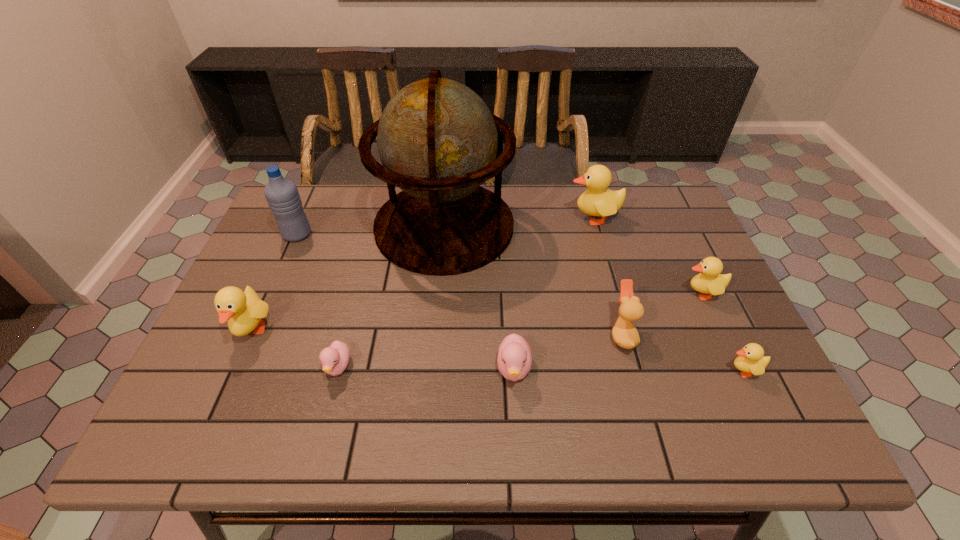
In order to click on globe in this screenshot , I will do `click(437, 140)`.

Find the location of a particular element. the eighth shortest object is located at coordinates (282, 195).

Locate an element on the screen. The image size is (960, 540). water bottle is located at coordinates (282, 195).

Image resolution: width=960 pixels, height=540 pixels. Find the location of `the biggest yellow duckling`. the biggest yellow duckling is located at coordinates (597, 200).

I want to click on the second yellow duckling from left to right, so click(x=597, y=200).

At what (x,y) coordinates should I click in order to perform the action: click on the leftmost duckling. Please return your answer as a coordinate pair (x, y). Image resolution: width=960 pixels, height=540 pixels. Looking at the image, I should click on (244, 310).

You are a GUI agent. You are given a task and a screenshot of the screen. Output one action in this format:
    pyautogui.click(x=<x>, y=<y>)
    Task: Click on the second tallest duckling
    This screenshot has height=540, width=960.
    Given the screenshot: What is the action you would take?
    point(244,310)

I want to click on tan duck, so click(x=624, y=334).

The height and width of the screenshot is (540, 960). What are the coordinates of `the third nearest yellow duckling` in the screenshot? It's located at (709, 281).

Identify the location of the sixth nearest object. (709, 281).